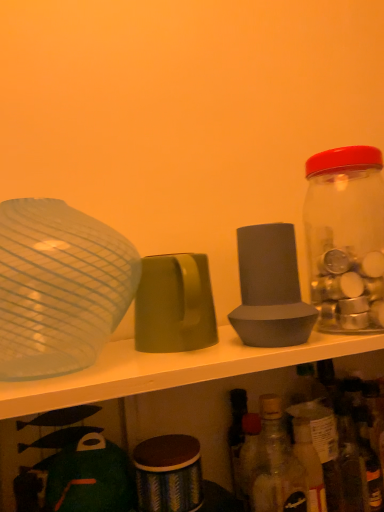
Question: Relative to translucent glass bottle at lower right, which ranks as the 2th bottle in top-to-bottom order, is gray matte speaker at center, which ranks as the 3th tableware in left-to-right order, in front or behind?

Choices:
 (A) behind
 (B) front

Answer: (A)

Question: Looking at the image, does gray matte speaker at center, which ranks as the 3th tableware in left-to-right order, seem bigger or smaller compared to translucent glass bottle at lower right, which ranks as the 2th bottle in top-to-bottom order?

Choices:
 (A) big
 (B) small

Answer: (B)

Question: Which object is positioned farthest from the gray matte speaker at center, the 1th tableware in the right-to-left sequence?

Choices:
 (A) transparent glass bowl at left, which is the 1th tableware from left to right
 (B) matte green cup at center, the 2th tableware positioned from the right
 (C) translucent glass bottle at lower right, which is the first bottle from left to right
 (D) transparent glass jar at right, placed as the 1th bottle when sorted from top to bottom

Answer: (A)

Question: Considering the real-world distances, which object is closest to the gray matte speaker at center, which ranks as the 3th tableware in left-to-right order?

Choices:
 (A) transparent glass jar at right, the 1th bottle from the right
 (B) transparent glass bowl at left, which is the 3th tableware from right to left
 (C) matte green cup at center, the 2th tableware viewed from the left
 (D) translucent glass bottle at lower right, which is the first bottle from left to right

Answer: (C)